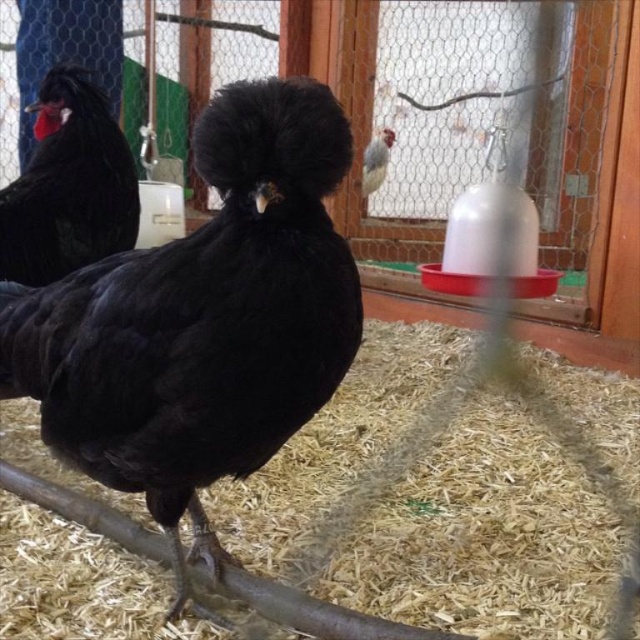
You are a farmer checking the coop and need to place a new rectangular feed container that is 1 meter wide. The container must be placed between the brown shredded hay at center and the matte black chicken at left. Based on their widths, will the container fit in the space between them?

The brown shredded hay at center has a width larger than the matte black chicken at left. Therefore, the total width between them would be the sum of both widths. Since the feed container is 1 meter wide, it depends on whether the combined width of the brown shredded hay and matte black chicken at left is at least 1 meter. However, without exact measurements, we cannot confirm if it will fit precisely. The question states the hay is wider than the chicken, but not by how much. Thus, the answer is inconclusi

You are a farmer checking the coop. You see the brown shredded hay at center and the speckled feathered chicken at upper center. Which object is located lower in the image?

The brown shredded hay at center is positioned under the speckled feathered chicken at upper center, so the brown shredded hay at center is lower in the image.

You are a chicken keeper who wants to place a new feeder in the coop. The existing red plastic feeder with a white container is currently placed against the wall. You have a new feeder that requires a minimum of 4 feet of space between it and the brown shredded hay at center. Can you place the new feeder near the existing one without violating the space requirement?

The existing red plastic feeder with a white container and the brown shredded hay at center are 4.23 feet apart. Since the new feeder requires a minimum of 4 feet of space between it and the brown shredded hay at center, placing the new feeder near the existing one would meet the requirement as 4.23 feet is more than 4 feet.